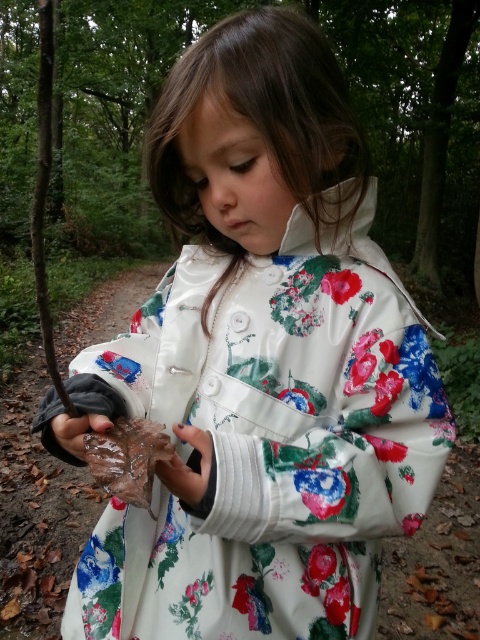
You are a hiker who needs to choose between the brown rough twig at left and the transparent plastic leaf at lower left to use as a temporary marker on a dirt path. Which object would be more visible to others from a distance?

The brown rough twig at left is wider than the transparent plastic leaf at lower left, so it would be more visible from a distance.

You are standing on the dirt path in the forest and want to walk to the nearest point between point (45, 115) and point (66, 444). Which point should you head towards?

Point (45, 115) is closer to the viewer than point (66, 444), so you should head towards point (45, 115).